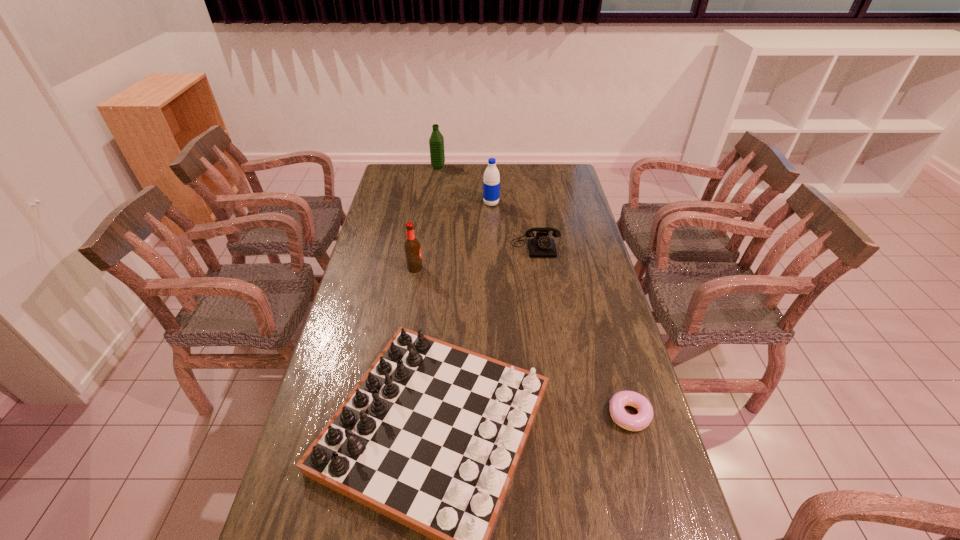
At what (x,y) coordinates should I click in order to perform the action: click on vacant space located 0.170m on the front of the right water bottle. Please return your answer as a coordinate pair (x, y). Looking at the image, I should click on (492, 231).

I want to click on vacant space located on the back of the fourth farthest object, so pyautogui.click(x=422, y=225).

Where is `free space located 0.390m on the front face of the telephone`? free space located 0.390m on the front face of the telephone is located at coordinates (549, 336).

Locate an element on the screen. The image size is (960, 540). vacant space positioned on the left of the shortest object is located at coordinates (501, 415).

Where is `object at the far edge`? object at the far edge is located at coordinates (436, 142).

This screenshot has height=540, width=960. I want to click on telephone that is at the right edge, so click(x=541, y=246).

Where is `doughnut that is at the right edge`? doughnut that is at the right edge is located at coordinates (640, 421).

Where is `vacant space at the far edge`? The image size is (960, 540). vacant space at the far edge is located at coordinates (449, 167).

In the image, there is a desktop. Identify the location of free region at the left edge. (371, 342).

This screenshot has height=540, width=960. Identify the location of free space at the right edge. (591, 264).